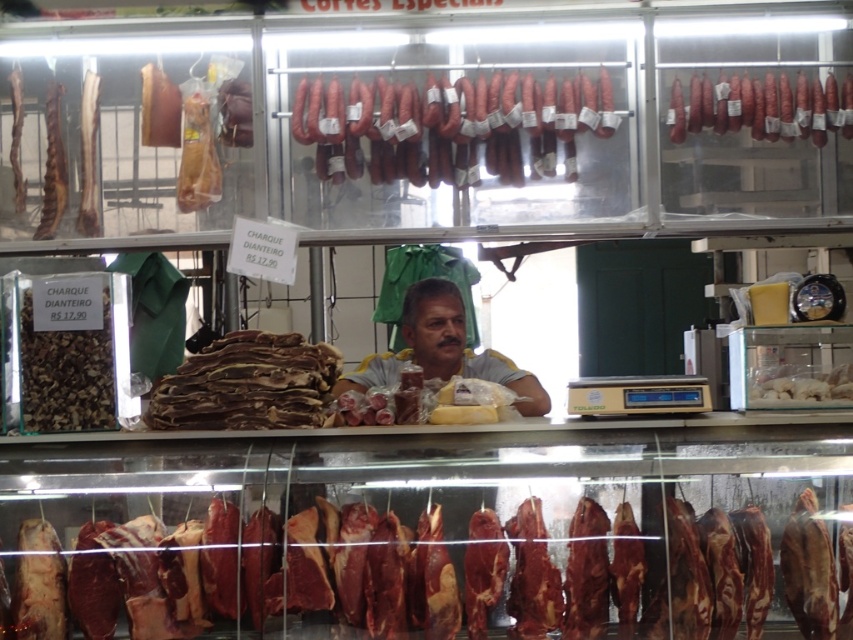
Question: Does smoked pink sausage at upper right appear on the left side of smoked brown meat at center?

Choices:
 (A) no
 (B) yes

Answer: (B)

Question: Is brown leather-like meat at center closer to the viewer compared to gray-yellow shirt at center?

Choices:
 (A) yes
 (B) no

Answer: (A)

Question: Which of the following is the closest to the observer?

Choices:
 (A) gray-yellow shirt at center
 (B) smoked pink meat at center

Answer: (B)

Question: Is smoked sausage at center to the right of brown leather-like meat at center from the viewer's perspective?

Choices:
 (A) yes
 (B) no

Answer: (A)

Question: Estimate the real-world distances between objects in this image. Which object is farther from the gray-yellow shirt at center?

Choices:
 (A) brown crumbly charque at left
 (B) matte brown meat at upper left
 (C) smoked sausage at center

Answer: (A)

Question: Which object is positioned closest to the matte brown meat at upper left?

Choices:
 (A) brown crumbly charque at left
 (B) translucent plastic bag at center
 (C) smoked sausage at center

Answer: (A)